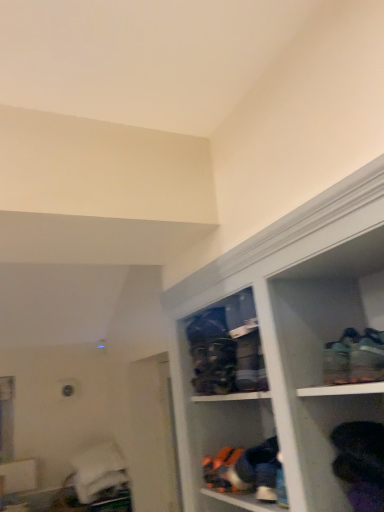
Question: Should I look upward or downward to see black fabric shoes at lower right?

Choices:
 (A) down
 (B) up

Answer: (A)

Question: From a real-world perspective, is matte plastic shoe rack at center positioned under black fabric shoes at lower right based on gravity?

Choices:
 (A) no
 (B) yes

Answer: (A)

Question: Considering the relative positions of matte plastic shoe rack at center and black fabric shoes at lower right in the image provided, is matte plastic shoe rack at center to the right of black fabric shoes at lower right from the viewer's perspective?

Choices:
 (A) yes
 (B) no

Answer: (B)

Question: Can you see matte plastic shoe rack at center touching black fabric shoes at lower right?

Choices:
 (A) no
 (B) yes

Answer: (A)

Question: From a real-world perspective, is matte plastic shoe rack at center on top of black fabric shoes at lower right?

Choices:
 (A) no
 (B) yes

Answer: (B)

Question: Is black fabric shoes at lower right at the back of matte plastic shoe rack at center?

Choices:
 (A) no
 (B) yes

Answer: (A)

Question: Does matte plastic shoe rack at center have a smaller size compared to black fabric shoes at lower right?

Choices:
 (A) no
 (B) yes

Answer: (A)

Question: From a real-world perspective, is green fabric shoe at upper right on matte plastic shoe rack at center?

Choices:
 (A) yes
 (B) no

Answer: (B)

Question: Is matte plastic shoe rack at center surrounded by green fabric shoe at upper right?

Choices:
 (A) no
 (B) yes

Answer: (A)

Question: Does green fabric shoe at upper right come behind matte plastic shoe rack at center?

Choices:
 (A) no
 (B) yes

Answer: (A)

Question: Is green fabric shoe at upper right completely or partially outside of matte plastic shoe rack at center?

Choices:
 (A) yes
 (B) no

Answer: (A)

Question: From the image's perspective, is green fabric shoe at upper right below matte plastic shoe rack at center?

Choices:
 (A) no
 (B) yes

Answer: (A)

Question: Is green fabric shoe at upper right positioned before matte plastic shoe rack at center?

Choices:
 (A) no
 (B) yes

Answer: (B)

Question: Is matte plastic shoe rack at center not inside green fabric shoe at upper right?

Choices:
 (A) yes
 (B) no

Answer: (A)